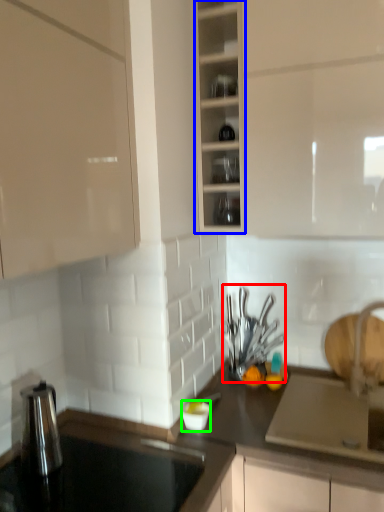
Question: Estimate the real-world distances between objects in this image. Which object is farther from tableware (highlighted by a red box), cabinetry (highlighted by a blue box) or tableware (highlighted by a green box)?

Choices:
 (A) cabinetry
 (B) tableware

Answer: (A)